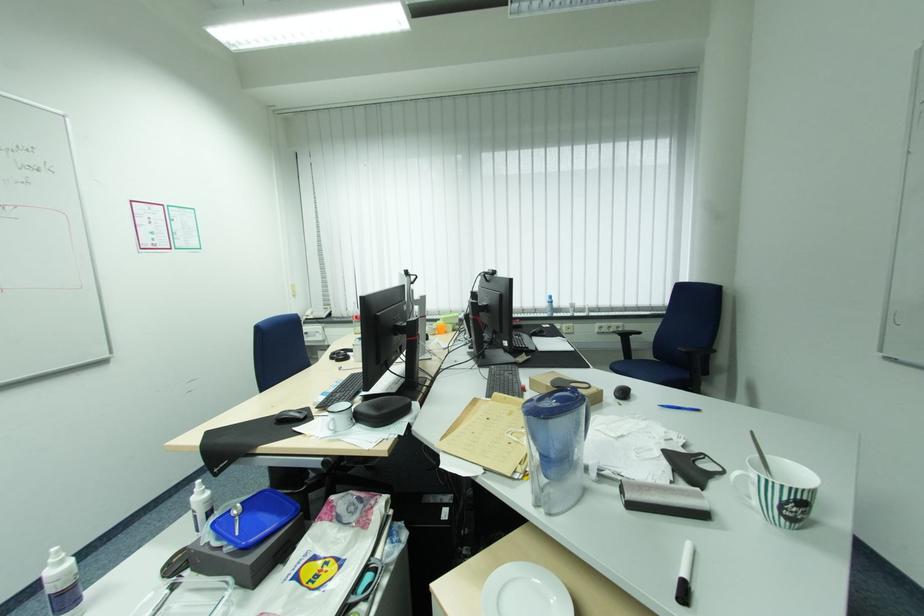
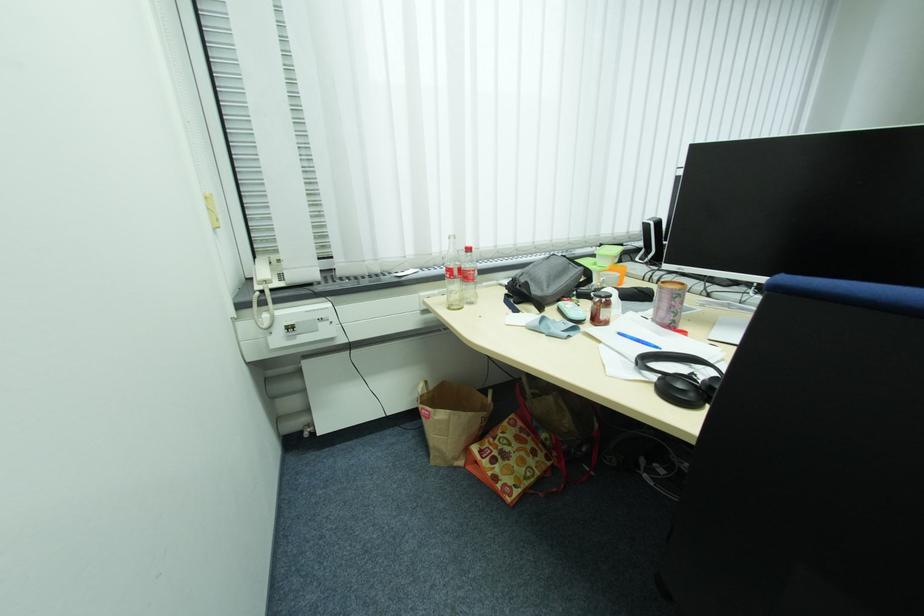
Find the pixel in the second image that matches point 361,334 in the first image.

(456, 309)